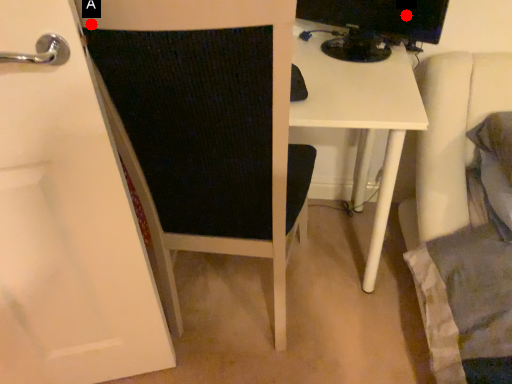
Question: Two points are circled on the image, labeled by A and B beside each circle. Which of the following is the closest to the observer?

Choices:
 (A) A is closer
 (B) B is closer

Answer: (A)